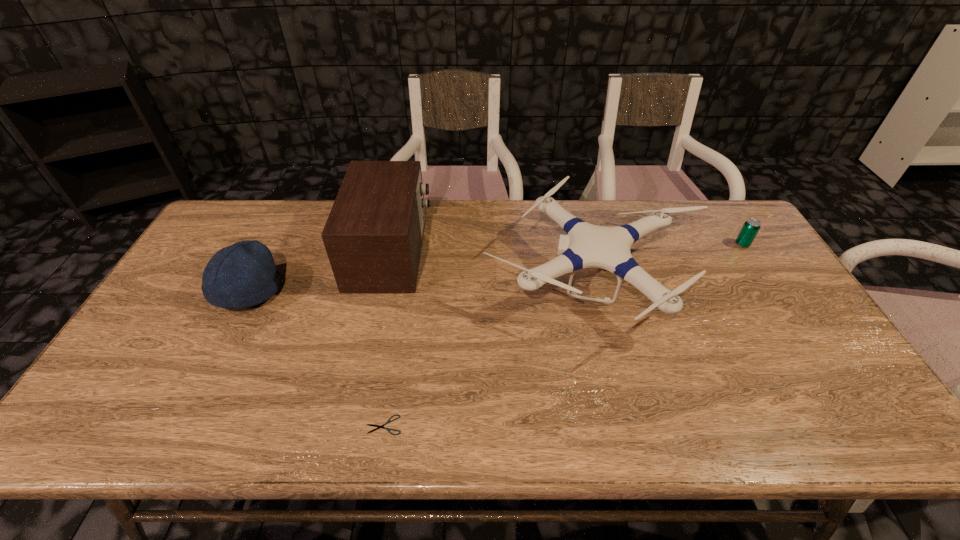
In the image, there is a desktop. Identify the location of free space at the far edge. (616, 207).

In the image, there is a desktop. Where is `free space at the near edge`? Image resolution: width=960 pixels, height=540 pixels. free space at the near edge is located at coordinates (366, 412).

Locate an element on the screen. The width and height of the screenshot is (960, 540). free spot at the left edge of the desktop is located at coordinates (204, 262).

Find the location of a particular element. This screenshot has width=960, height=540. vacant point located between the third shortest object and the tallest object is located at coordinates (320, 272).

Find the location of a particular element. The width and height of the screenshot is (960, 540). free space between the drone and the leftmost object is located at coordinates (420, 286).

What are the coordinates of `unoccupied area between the second object from right to left and the rightmost object` in the screenshot? It's located at [668, 262].

At what (x,y) coordinates should I click in order to perform the action: click on free point between the shortest object and the skullcap. Please return your answer as a coordinate pair (x, y). The width and height of the screenshot is (960, 540). Looking at the image, I should click on (316, 359).

The image size is (960, 540). In order to click on vacant area between the tallest object and the third tallest object in this screenshot , I will do `click(320, 272)`.

This screenshot has height=540, width=960. Identify the location of vacant area between the second object from right to left and the rightmost object. (668, 262).

You are a GUI agent. You are given a task and a screenshot of the screen. Output one action in this format:
    pyautogui.click(x=<x>, y=<y>)
    Task: Click on the empty location between the shortest object and the tallest object
    This screenshot has height=540, width=960.
    Given the screenshot: What is the action you would take?
    pyautogui.click(x=387, y=338)